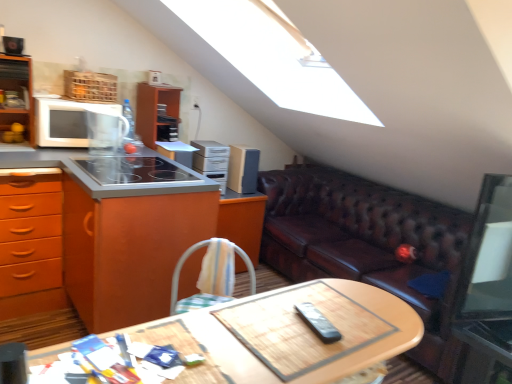
At what (x,y) coordinates should I click in order to perform the action: click on empty space that is ontop of wooden at center (from a real-world perspective). Please return your answer as a coordinate pair (x, y). Looking at the image, I should click on (270, 336).